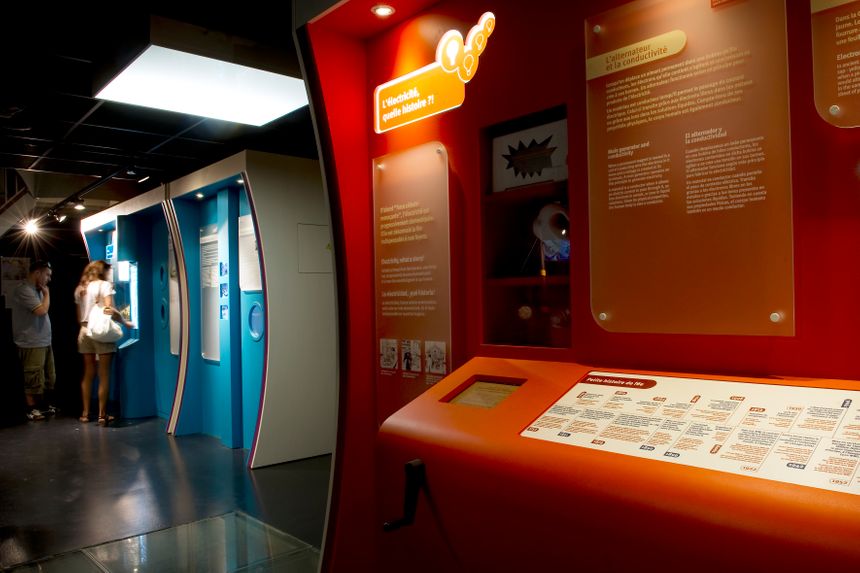
Where is `ceiling`? ceiling is located at coordinates (83, 170), (58, 54).